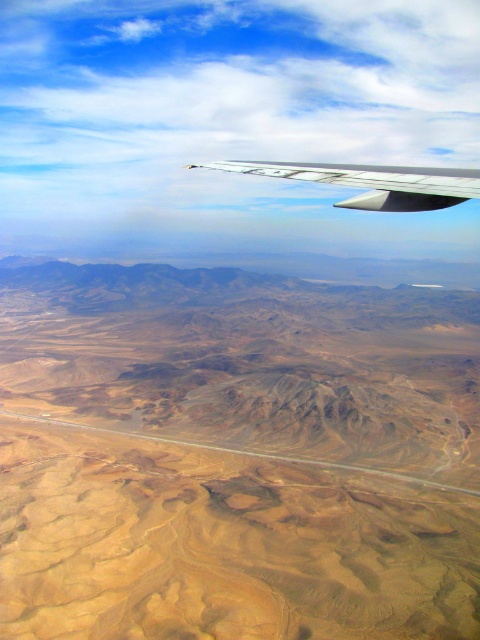
Question: Which point is closer to the camera?

Choices:
 (A) (385, 195)
 (B) (289, 314)

Answer: (A)

Question: Is desert sand at lower center to the left of silver metallic wing at upper center from the viewer's perspective?

Choices:
 (A) no
 (B) yes

Answer: (A)

Question: Among these points, which one is farthest from the camera?

Choices:
 (A) (383, 192)
 (B) (96, 392)

Answer: (B)

Question: Observing the image, what is the correct spatial positioning of desert sand at lower center in reference to silver metallic wing at upper center?

Choices:
 (A) right
 (B) left

Answer: (A)

Question: Is desert sand at lower center to the right of silver metallic wing at upper center from the viewer's perspective?

Choices:
 (A) no
 (B) yes

Answer: (B)

Question: Among these points, which one is farthest from the camera?

Choices:
 (A) (34, 529)
 (B) (436, 168)

Answer: (A)